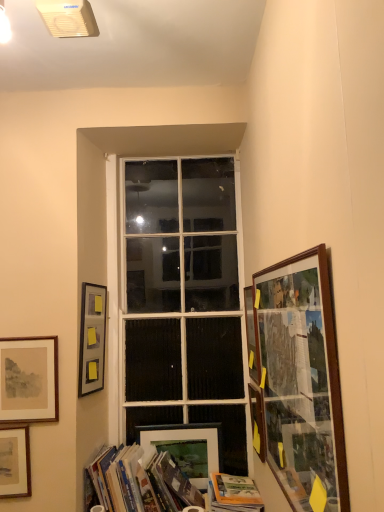
Question: Is wooden framed map at right, arranged as the 1th picture frame when viewed from the right, not within hardcover books at lower center, acting as the 1th book starting from the left?

Choices:
 (A) no
 (B) yes

Answer: (B)

Question: Is wooden framed map at right, arranged as the 1th picture frame when viewed from the right, facing towards hardcover books at lower center, the 2th book viewed from the right?

Choices:
 (A) yes
 (B) no

Answer: (A)

Question: Is wooden framed map at right, arranged as the 1th picture frame when viewed from the right, to the right of hardcover books at lower center, acting as the 1th book starting from the left, from the viewer's perspective?

Choices:
 (A) yes
 (B) no

Answer: (A)

Question: From a real-world perspective, is wooden framed map at right, positioned as the seventh picture frame in left-to-right order, located higher than hardcover books at lower center, the 2th book viewed from the right?

Choices:
 (A) no
 (B) yes

Answer: (B)

Question: From the image's perspective, is wooden framed map at right, arranged as the 1th picture frame when viewed from the right, under hardcover books at lower center, acting as the 1th book starting from the left?

Choices:
 (A) yes
 (B) no

Answer: (B)

Question: Does point (54, 409) appear closer or farther from the camera than point (268, 290)?

Choices:
 (A) closer
 (B) farther

Answer: (B)

Question: Is matte paper picture frame at lower left, the second picture frame when ordered from left to right, taller or shorter than wooden-framed collage at right, placed as the second picture frame when sorted from right to left?

Choices:
 (A) short
 (B) tall

Answer: (A)

Question: From the image's perspective, is matte paper picture frame at lower left, which appears as the 6th picture frame when viewed from the right, positioned above or below wooden-framed collage at right, arranged as the sixth picture frame when viewed from the left?

Choices:
 (A) below
 (B) above

Answer: (A)

Question: In the image, is matte paper picture frame at lower left, which appears as the 6th picture frame when viewed from the right, positioned in front of or behind wooden-framed collage at right, placed as the second picture frame when sorted from right to left?

Choices:
 (A) front
 (B) behind

Answer: (B)

Question: Looking at their shapes, would you say wooden-framed collage at right, placed as the second picture frame when sorted from right to left, is wider or thinner than white glass window at center?

Choices:
 (A) thin
 (B) wide

Answer: (A)

Question: Do you think wooden-framed collage at right, placed as the second picture frame when sorted from right to left, is within white glass window at center, or outside of it?

Choices:
 (A) inside
 (B) outside

Answer: (B)

Question: Is wooden-framed collage at right, placed as the second picture frame when sorted from right to left, in front of or behind white glass window at center in the image?

Choices:
 (A) front
 (B) behind

Answer: (A)

Question: Considering the positions of wooden-framed collage at right, placed as the second picture frame when sorted from right to left, and white glass window at center in the image, is wooden-framed collage at right, placed as the second picture frame when sorted from right to left, taller or shorter than white glass window at center?

Choices:
 (A) tall
 (B) short

Answer: (B)

Question: Is matte paper picture frame at lower left, which appears as the 6th picture frame when viewed from the right, inside the boundaries of matte white picture frame at lower center, which is the fourth picture frame in left-to-right order, or outside?

Choices:
 (A) inside
 (B) outside

Answer: (B)

Question: From the image's perspective, is matte paper picture frame at lower left, which appears as the 6th picture frame when viewed from the right, located above or below matte white picture frame at lower center, the 4th picture frame when ordered from right to left?

Choices:
 (A) above
 (B) below

Answer: (A)